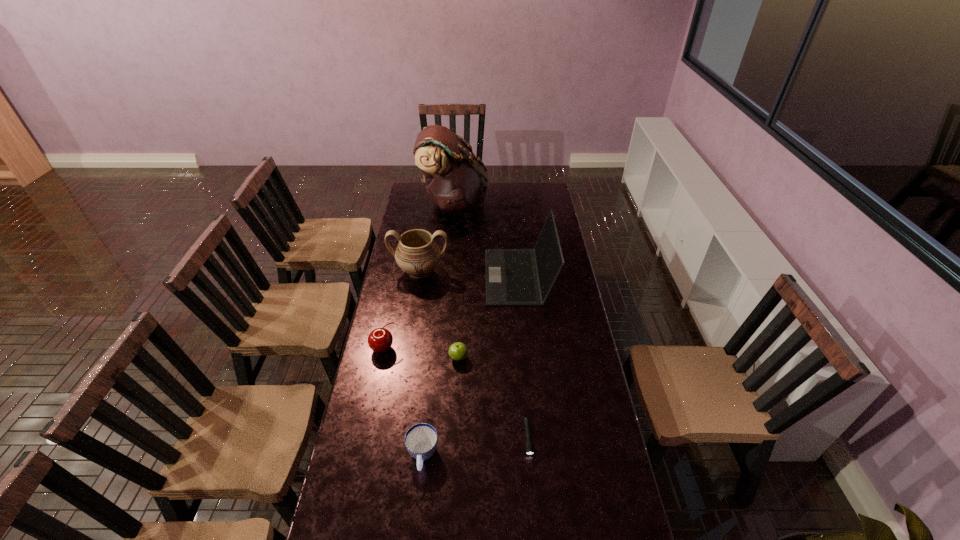
Image resolution: width=960 pixels, height=540 pixels. Find the location of `empty location between the cup and the fourth shortest object`. empty location between the cup and the fourth shortest object is located at coordinates (403, 402).

The width and height of the screenshot is (960, 540). I want to click on empty space that is in between the apple and the satchel, so click(x=456, y=280).

At what (x,y) coordinates should I click in order to perform the action: click on free point between the fourth tallest object and the flashlight. Please return your answer as a coordinate pair (x, y). This screenshot has width=960, height=540. Looking at the image, I should click on (456, 394).

This screenshot has width=960, height=540. Find the location of `blank region between the fourth shortest object and the laptop`. blank region between the fourth shortest object and the laptop is located at coordinates (451, 312).

The image size is (960, 540). In order to click on free spot between the farthest object and the laptop in this screenshot , I will do `click(487, 240)`.

Where is `vacant space that is in between the laptop and the farthest object`? Image resolution: width=960 pixels, height=540 pixels. vacant space that is in between the laptop and the farthest object is located at coordinates (487, 240).

You are a GUI agent. You are given a task and a screenshot of the screen. Output one action in this format:
    pyautogui.click(x=<x>, y=<y>)
    Task: Click on the object that stands as the fourth closest to the laptop
    
    Given the screenshot: What is the action you would take?
    pyautogui.click(x=380, y=340)

Point out which object is positioned as the nearest to the urn. Please provide its 2D coordinates. Your answer should be formatted as a tuple, i.e. [(x, y)], where the tuple contains the x and y coordinates of a point satisfying the conditions above.

[(513, 276)]

Where is `vacant position in the image that satisfies the following two spatial constraints: 1. on the screen of the laptop; 2. on the side of the cup with the handle`? This screenshot has height=540, width=960. vacant position in the image that satisfies the following two spatial constraints: 1. on the screen of the laptop; 2. on the side of the cup with the handle is located at coordinates (538, 456).

At what (x,y) coordinates should I click in order to perform the action: click on free spot that satisfies the following two spatial constraints: 1. on the screen of the laptop; 2. at the lens end of the flashlight. Please return your answer as a coordinate pair (x, y). This screenshot has height=540, width=960. Looking at the image, I should click on (536, 438).